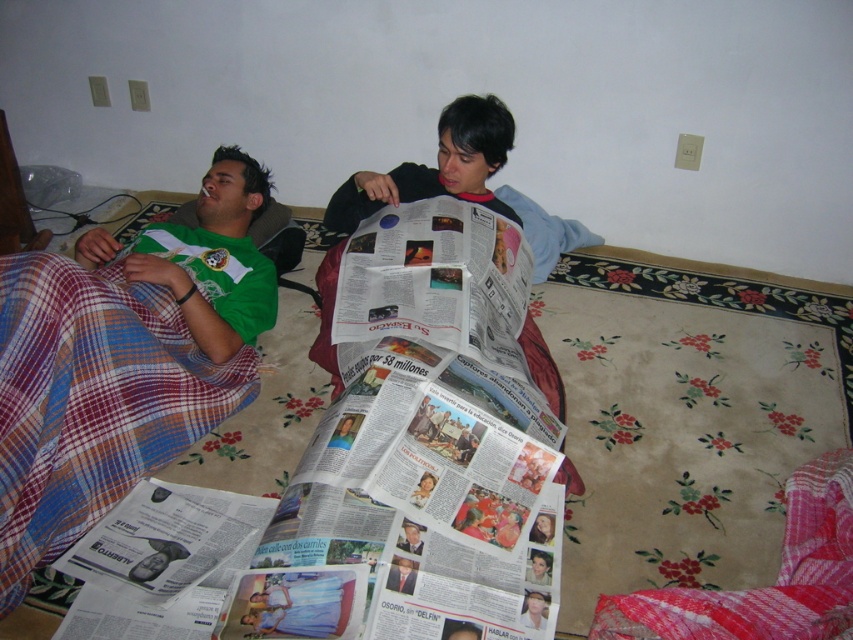
Between plaid fabric blanket at lower left and green jersey at left, which one has less height?

Standing shorter between the two is green jersey at left.

This screenshot has width=853, height=640. What do you see at coordinates (91, 401) in the screenshot?
I see `plaid fabric blanket at lower left` at bounding box center [91, 401].

At what (x,y) coordinates should I click in order to perform the action: click on plaid fabric blanket at lower left. Please return your answer as a coordinate pair (x, y). Looking at the image, I should click on (91, 401).

Is plaid fabric blanket at lower right positioned before green jersey at left?

Yes.

Image resolution: width=853 pixels, height=640 pixels. What do you see at coordinates (764, 586) in the screenshot?
I see `plaid fabric blanket at lower right` at bounding box center [764, 586].

Where is `plaid fabric blanket at lower right`? plaid fabric blanket at lower right is located at coordinates (764, 586).

Does green jersey at left have a lesser width compared to printed paper newspaper at center?

Indeed, green jersey at left has a lesser width compared to printed paper newspaper at center.

Which is more to the left, green jersey at left or printed paper newspaper at center?

From the viewer's perspective, green jersey at left appears more on the left side.

Is point (163, 243) positioned before point (282, 451)?

No, it is behind (282, 451).

Identify the location of green jersey at left. The height and width of the screenshot is (640, 853). pos(215,259).